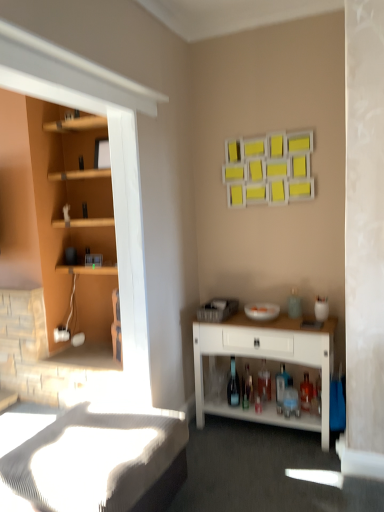
Identify the location of vacant point above white wood desk at lower right (from a real-world perspective). (259, 322).